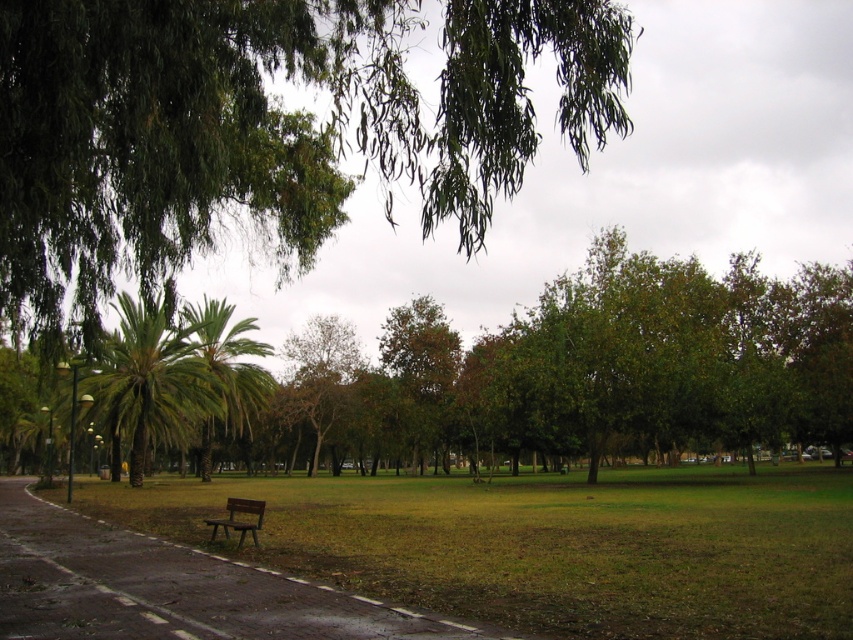
You are standing at the point labeled as point (531, 376) in the park scene. What type of tree do you see directly in front of you?

The point (531, 376) corresponds to a green leafy tree at center, so you see a green leafy tree directly in front of you.